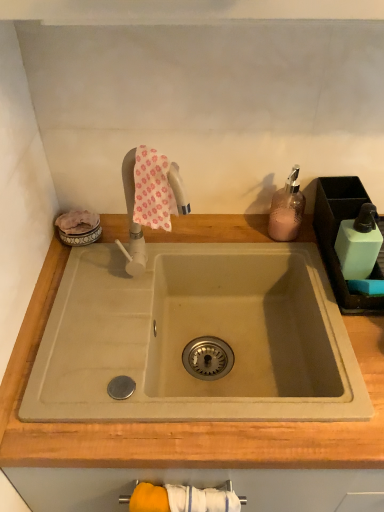
The height and width of the screenshot is (512, 384). Find the location of `light green plastic soap dispenser at right`. light green plastic soap dispenser at right is located at coordinates (358, 244).

What is the approximate height of light green plastic soap dispenser at right?

light green plastic soap dispenser at right is 15.60 centimeters tall.

Find the location of `pink floral fabric at upper center`. pink floral fabric at upper center is located at coordinates (153, 190).

Locate an element on the screen. Image resolution: width=384 pixels, height=512 pixels. pink textured soap dispenser at upper right is located at coordinates (287, 209).

What do you see at coordinates (180, 499) in the screenshot? This screenshot has height=512, width=384. I see `yellow fabric towel bar at lower center` at bounding box center [180, 499].

The image size is (384, 512). Describe the element at coordinates (184, 422) in the screenshot. I see `beige wood countertop at center` at that location.

Image resolution: width=384 pixels, height=512 pixels. Identify the location of light green plastic soap dispenser at right. (358, 244).

Does beige wood countertop at center have a larger size compared to light green plastic soap dispenser at right?

Yes.

Which is behind, beige wood countertop at center or light green plastic soap dispenser at right?

light green plastic soap dispenser at right is further away from the camera.

Which object is positioned more to the right, beige wood countertop at center or light green plastic soap dispenser at right?

light green plastic soap dispenser at right is more to the right.

Is beige wood countertop at center with light green plastic soap dispenser at right?

beige wood countertop at center and light green plastic soap dispenser at right are clearly separated.

Is yellow fabric towel bar at lower center positioned beyond the bounds of pink textured soap dispenser at upper right?

yellow fabric towel bar at lower center lies outside pink textured soap dispenser at upper right's area.

From the picture: Considering the sizes of yellow fabric towel bar at lower center and pink textured soap dispenser at upper right in the image, is yellow fabric towel bar at lower center bigger or smaller than pink textured soap dispenser at upper right?

Considering their sizes, yellow fabric towel bar at lower center takes up more space than pink textured soap dispenser at upper right.

You are a GUI agent. You are given a task and a screenshot of the screen. Output one action in this format:
    pyautogui.click(x=<x>, y=<y>)
    Task: Click on the soap dispenser above the yellow fabric towel bar at lower center (from the image's perspective)
    The height and width of the screenshot is (512, 384).
    Given the screenshot: What is the action you would take?
    pyautogui.click(x=287, y=209)

Looking at their sizes, would you say yellow fabric towel bar at lower center is wider or thinner than pink textured soap dispenser at upper right?

Considering their sizes, yellow fabric towel bar at lower center looks slimmer than pink textured soap dispenser at upper right.

In terms of height, does light green plastic soap dispenser at right look taller or shorter compared to beige wood countertop at center?

Clearly, light green plastic soap dispenser at right is shorter compared to beige wood countertop at center.

Is light green plastic soap dispenser at right wider or thinner than beige wood countertop at center?

Considering their sizes, light green plastic soap dispenser at right looks slimmer than beige wood countertop at center.

Image resolution: width=384 pixels, height=512 pixels. In order to click on countertop on the left of light green plastic soap dispenser at right in this screenshot , I will do `click(184, 422)`.

Which is more to the right, light green plastic soap dispenser at right or beige wood countertop at center?

From the viewer's perspective, light green plastic soap dispenser at right appears more on the right side.

Do you think yellow fabric towel bar at lower center is within beige wood countertop at center, or outside of it?

yellow fabric towel bar at lower center is contained in beige wood countertop at center.

Considering the points (176, 490) and (283, 442), which point is behind, point (176, 490) or point (283, 442)?

The point (176, 490) is farther from the camera.

Is yellow fabric towel bar at lower center beside beige wood countertop at center?

There is a gap between yellow fabric towel bar at lower center and beige wood countertop at center.

From a real-world perspective, between pink floral fabric at upper center and pink textured soap dispenser at upper right, who is vertically lower?

pink textured soap dispenser at upper right.

Who is shorter, pink floral fabric at upper center or pink textured soap dispenser at upper right?

pink floral fabric at upper center is shorter.

From the picture: From the image's perspective, is pink floral fabric at upper center located above or below pink textured soap dispenser at upper right?

Based on their image positions, pink floral fabric at upper center is located beneath pink textured soap dispenser at upper right.

Could you tell me if pink floral fabric at upper center is facing pink textured soap dispenser at upper right?

No, pink floral fabric at upper center is not aimed at pink textured soap dispenser at upper right.

Is pink textured soap dispenser at upper right next to beige wood countertop at center?

No, pink textured soap dispenser at upper right is not touching beige wood countertop at center.

Locate an element on the screen. countertop on the left of pink textured soap dispenser at upper right is located at coordinates (184, 422).

From the picture: Is pink textured soap dispenser at upper right not within beige wood countertop at center?

pink textured soap dispenser at upper right lies outside beige wood countertop at center's area.

From a real-world perspective, is pink textured soap dispenser at upper right physically above beige wood countertop at center?

Yes, from a real-world perspective, pink textured soap dispenser at upper right is above beige wood countertop at center.

Is yellow fabric towel bar at lower center completely or partially outside of light green plastic soap dispenser at right?

yellow fabric towel bar at lower center lies outside light green plastic soap dispenser at right's area.

Locate an element on the screen. towel bar beneath the light green plastic soap dispenser at right (from a real-world perspective) is located at coordinates (180, 499).

Based on the photo, is yellow fabric towel bar at lower center positioned behind light green plastic soap dispenser at right?

No, yellow fabric towel bar at lower center is closer to the camera.

Is yellow fabric towel bar at lower center beside light green plastic soap dispenser at right?

yellow fabric towel bar at lower center is not next to light green plastic soap dispenser at right, and they're not touching.

Find the location of a particular element. The width and height of the screenshot is (384, 512). countertop on the left side of light green plastic soap dispenser at right is located at coordinates (184, 422).

The image size is (384, 512). Find the location of `towel bar below the pink textured soap dispenser at upper right (from a real-world perspective)`. towel bar below the pink textured soap dispenser at upper right (from a real-world perspective) is located at coordinates (180, 499).

From the image, which object appears to be farther from light green plastic soap dispenser at right, pink floral fabric at upper center or pink textured soap dispenser at upper right?

Among the two, pink floral fabric at upper center is located further to light green plastic soap dispenser at right.

Looking at the image, which one is located further to pink textured soap dispenser at upper right, beige wood countertop at center or pink floral fabric at upper center?

The object further to pink textured soap dispenser at upper right is pink floral fabric at upper center.

When comparing their distances from yellow fabric towel bar at lower center, does light green plastic soap dispenser at right or beige wood countertop at center seem further?

light green plastic soap dispenser at right.

Which object lies further to the anchor point light green plastic soap dispenser at right, yellow fabric towel bar at lower center or beige wood countertop at center?

Among the two, yellow fabric towel bar at lower center is located further to light green plastic soap dispenser at right.

Estimate the real-world distances between objects in this image. Which object is closer to beige wood countertop at center, pink textured soap dispenser at upper right or light green plastic soap dispenser at right?

light green plastic soap dispenser at right lies closer to beige wood countertop at center than the other object.

Based on their spatial positions, is yellow fabric towel bar at lower center or beige wood countertop at center further from pink floral fabric at upper center?

yellow fabric towel bar at lower center is positioned further to the anchor pink floral fabric at upper center.

Considering their positions, is pink textured soap dispenser at upper right positioned further to yellow fabric towel bar at lower center than light green plastic soap dispenser at right?

The object further to yellow fabric towel bar at lower center is pink textured soap dispenser at upper right.

Considering their positions, is pink textured soap dispenser at upper right positioned further to pink floral fabric at upper center than beige wood countertop at center?

pink textured soap dispenser at upper right is further to pink floral fabric at upper center.

Locate an element on the screen. This screenshot has width=384, height=512. toiletry between pink floral fabric at upper center and beige wood countertop at center from top to bottom is located at coordinates (358, 244).

In order to click on toiletry between pink textured soap dispenser at upper right and beige wood countertop at center in the up-down direction in this screenshot , I will do `click(358, 244)`.

You are a GUI agent. You are given a task and a screenshot of the screen. Output one action in this format:
    pyautogui.click(x=<x>, y=<y>)
    Task: Click on the soap dispenser between pink floral fabric at upper center and light green plastic soap dispenser at right from left to right
    This screenshot has height=512, width=384.
    Given the screenshot: What is the action you would take?
    pyautogui.click(x=287, y=209)

Where is `bath towel that lies between pink textured soap dispenser at upper right and yellow fabric towel bar at lower center from top to bottom`? Image resolution: width=384 pixels, height=512 pixels. bath towel that lies between pink textured soap dispenser at upper right and yellow fabric towel bar at lower center from top to bottom is located at coordinates (153, 190).